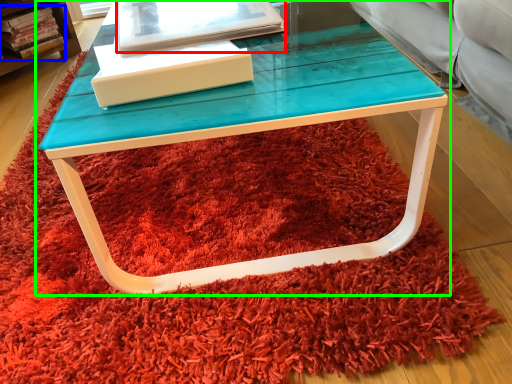
Question: Which object is the closest to the book (highlighted by a red box)? Choose among these: book (highlighted by a blue box) or table (highlighted by a green box).

Choices:
 (A) book
 (B) table

Answer: (B)